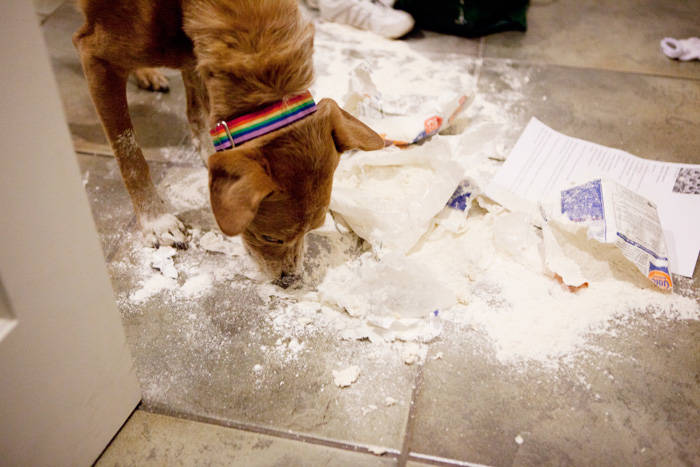
Locate an element on the screen. Image resolution: width=700 pixels, height=467 pixels. sock is located at coordinates (671, 50).